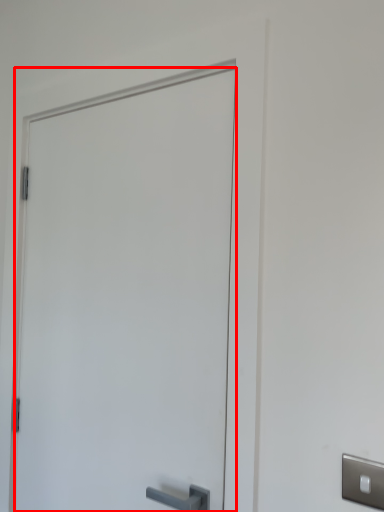
Question: From the image's perspective, where is door (annotated by the red box) located relative to light switch?

Choices:
 (A) above
 (B) below

Answer: (A)